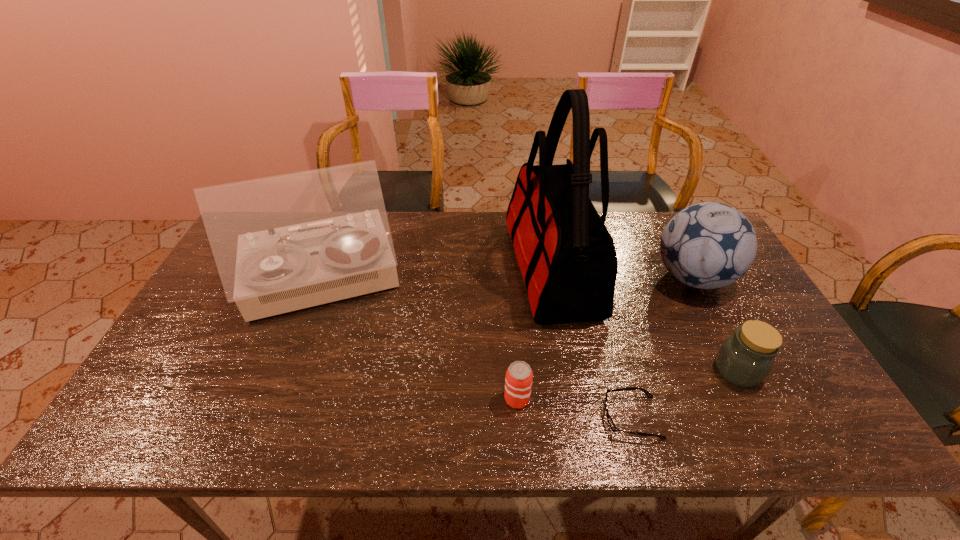
Identify the location of the tallest object. (567, 257).

Find the location of a particular element. the leftmost object is located at coordinates (282, 243).

Locate an element on the screen. This screenshot has height=540, width=960. record player is located at coordinates (282, 243).

Identify the location of soccer ball. (709, 245).

Where is `the fourth tallest object`? the fourth tallest object is located at coordinates (745, 359).

Identify the location of the second shortest object. (518, 382).

Identify the location of spectacles. (609, 419).

Where is `vacant position located on the left of the tallest object`? The height and width of the screenshot is (540, 960). vacant position located on the left of the tallest object is located at coordinates (466, 269).

In order to click on free space located on the front of the record player in this screenshot , I will do `click(288, 371)`.

Where is `free space located on the side with brand of the soccer ball`? free space located on the side with brand of the soccer ball is located at coordinates (602, 278).